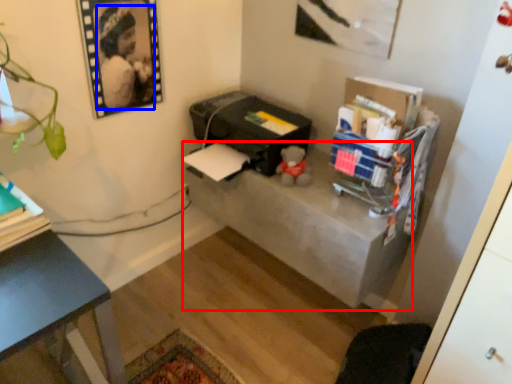
Question: Among these objects, which one is nearest to the camera, table (highlighted by a red box) or person (highlighted by a blue box)?

Choices:
 (A) table
 (B) person

Answer: (B)